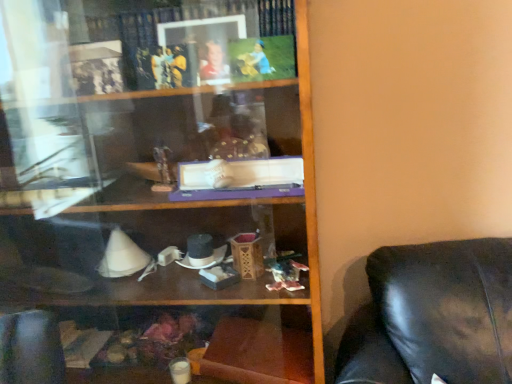
The width and height of the screenshot is (512, 384). What do you see at coordinates (155, 188) in the screenshot? I see `wooden bookcase at center` at bounding box center [155, 188].

In order to face wooden bookcase at center, should I rotate leftwards or rightwards?

Turn left approximately 16.035 degrees to face it.

Find the location of a particular element. This screenshot has width=512, height=384. wooden bookcase at center is located at coordinates (155, 188).

Image resolution: width=512 pixels, height=384 pixels. I want to click on wooden bookcase at center, so click(x=155, y=188).